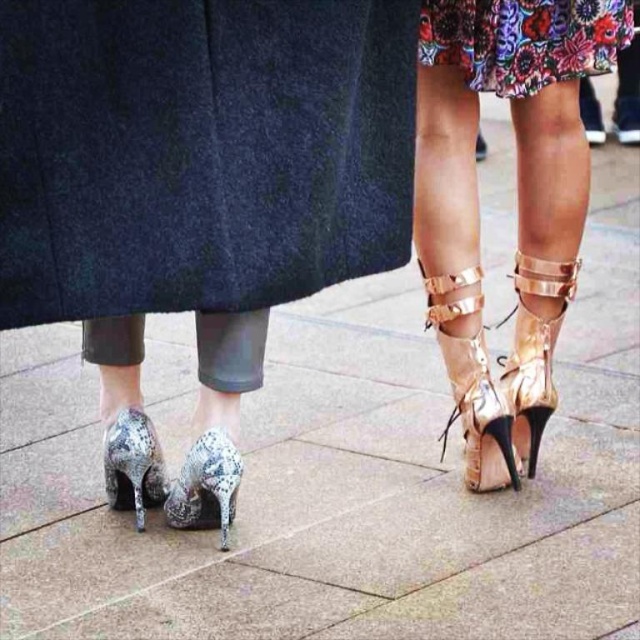
Who is more distant from viewer, (x=529, y=52) or (x=515, y=461)?

Point (x=515, y=461)

Consider the image. Between floral printed fabric skirt at upper center and gold metallic high-heeled shoe at center-right, which one has less height?

floral printed fabric skirt at upper center is shorter.

Find the location of a particular element. Image resolution: width=640 pixels, height=640 pixels. floral printed fabric skirt at upper center is located at coordinates click(x=524, y=40).

Could you measure the distance between metallic gold high-heeled boots at center and gold metallic high-heeled shoe at center-right?

6.91 inches

Does metallic gold high-heeled boots at center have a greater width compared to gold metallic high-heeled shoe at center-right?

Indeed, metallic gold high-heeled boots at center has a greater width compared to gold metallic high-heeled shoe at center-right.

Is point (531, 308) less distant than point (486, 480)?

Yes.

Where is `metallic gold high-heeled boots at center`? metallic gold high-heeled boots at center is located at coordinates (516, 200).

Can you confirm if shiny metallic high heels at center is thinner than gold metallic high-heeled shoe at center-right?

No.

Is shiny metallic high heels at center smaller than gold metallic high-heeled shoe at center-right?

Actually, shiny metallic high heels at center might be larger than gold metallic high-heeled shoe at center-right.

Between point (116, 257) and point (468, 436), which one is positioned in front?

Point (116, 257)

This screenshot has width=640, height=640. In order to click on shiny metallic high heels at center in this screenshot , I will do `click(198, 170)`.